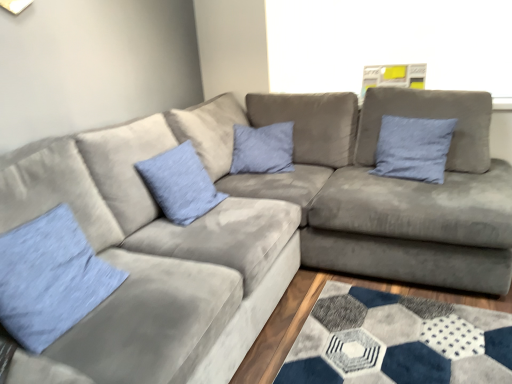
Question: Is blue fabric pillow at upper right, the first pillow in the back-to-front sequence, in front of blue fabric pillow at center, the second pillow positioned from the front?

Choices:
 (A) yes
 (B) no

Answer: (B)

Question: From the image's perspective, is blue fabric pillow at upper right, which is the third pillow in left-to-right order, beneath blue fabric pillow at center, which is counted as the 2th pillow, starting from the back?

Choices:
 (A) no
 (B) yes

Answer: (A)

Question: Considering the relative sizes of blue fabric pillow at upper right, the first pillow in the right-to-left sequence, and blue fabric pillow at center, which appears as the second pillow when viewed from the right, in the image provided, is blue fabric pillow at upper right, the first pillow in the right-to-left sequence, wider than blue fabric pillow at center, which appears as the second pillow when viewed from the right,?

Choices:
 (A) yes
 (B) no

Answer: (B)

Question: Considering the relative sizes of blue fabric pillow at upper right, the first pillow in the right-to-left sequence, and blue fabric pillow at center, acting as the second pillow starting from the left, in the image provided, is blue fabric pillow at upper right, the first pillow in the right-to-left sequence, taller than blue fabric pillow at center, acting as the second pillow starting from the left,?

Choices:
 (A) no
 (B) yes

Answer: (B)

Question: Does blue fabric pillow at upper right, the first pillow in the right-to-left sequence, appear on the left side of blue fabric pillow at center, acting as the second pillow starting from the left?

Choices:
 (A) no
 (B) yes

Answer: (A)

Question: In the image, is blue fabric pillow at upper right, the first pillow in the right-to-left sequence, positioned in front of or behind light blue fabric pillow at lower left, the first pillow from the front?

Choices:
 (A) behind
 (B) front

Answer: (A)

Question: Is blue fabric pillow at upper right, the first pillow in the back-to-front sequence, taller or shorter than light blue fabric pillow at lower left, which is counted as the third pillow, starting from the back?

Choices:
 (A) short
 (B) tall

Answer: (B)

Question: Based on their positions, is blue fabric pillow at upper right, the first pillow in the back-to-front sequence, located to the left or right of light blue fabric pillow at lower left, which is counted as the 3th pillow, starting from the right?

Choices:
 (A) left
 (B) right

Answer: (B)

Question: Is point (411, 135) closer or farther from the camera than point (54, 296)?

Choices:
 (A) closer
 (B) farther

Answer: (B)

Question: Visually, is blue fabric pillow at upper right, which is counted as the 3th pillow, starting from the front, positioned to the left or to the right of blue fabric pillow at center, which appears as the second pillow when viewed from the right?

Choices:
 (A) right
 (B) left

Answer: (A)

Question: From a real-world perspective, is blue fabric pillow at upper right, the first pillow in the back-to-front sequence, above or below blue fabric pillow at center, which appears as the second pillow when viewed from the right?

Choices:
 (A) below
 (B) above

Answer: (B)

Question: Considering the positions of point (394, 130) and point (178, 175), is point (394, 130) closer or farther from the camera than point (178, 175)?

Choices:
 (A) farther
 (B) closer

Answer: (A)

Question: Is blue fabric pillow at upper right, the first pillow in the right-to-left sequence, taller or shorter than blue fabric pillow at center, acting as the second pillow starting from the left?

Choices:
 (A) tall
 (B) short

Answer: (A)

Question: In terms of height, does light blue fabric pillow at lower left, the 1th pillow viewed from the left, look taller or shorter compared to blue fabric pillow at upper right, which is counted as the 3th pillow, starting from the front?

Choices:
 (A) tall
 (B) short

Answer: (B)

Question: Would you say light blue fabric pillow at lower left, the first pillow from the front, is inside or outside blue fabric pillow at upper right, the first pillow in the right-to-left sequence?

Choices:
 (A) inside
 (B) outside

Answer: (B)